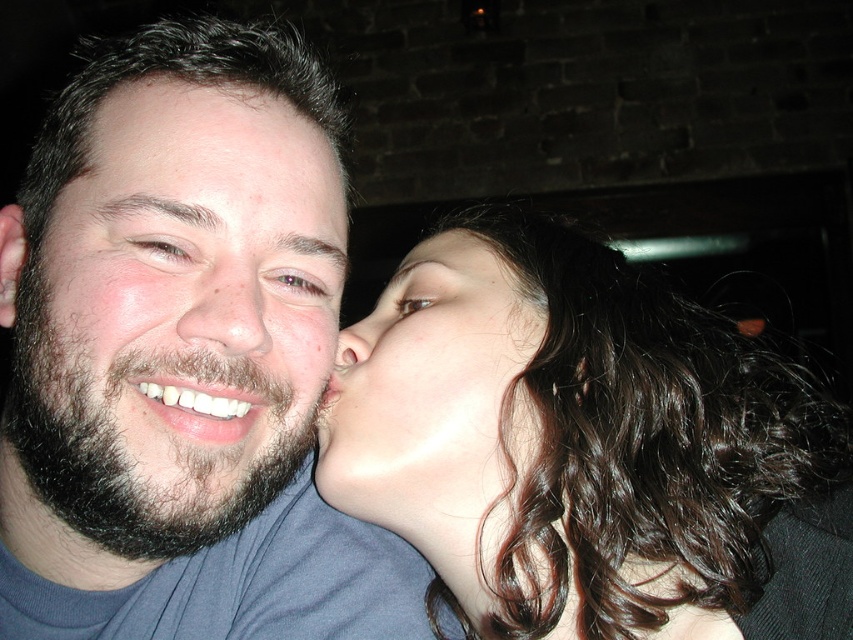
Where is the smooth skin face at center located in the image?

The smooth skin face at center is located at point coordinates of (434, 394).